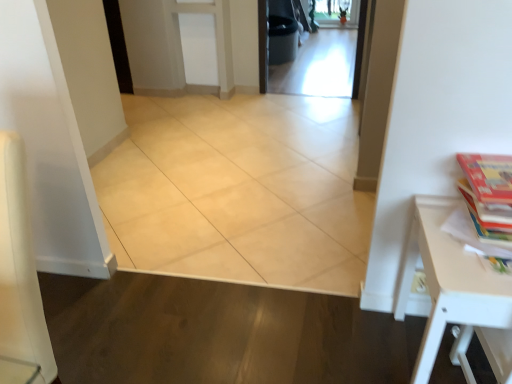
The height and width of the screenshot is (384, 512). Find the location of `vacant space to the left of multicolored paper book at right`. vacant space to the left of multicolored paper book at right is located at coordinates (443, 233).